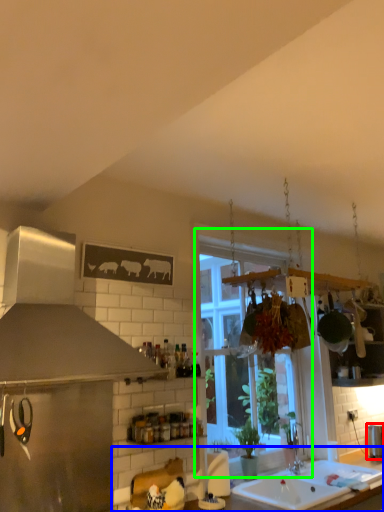
Question: Estimate the real-world distances between objects in this image. Which object is farther from appliance (highlighted by a red box), countertop (highlighted by a blue box) or window (highlighted by a green box)?

Choices:
 (A) countertop
 (B) window

Answer: (B)